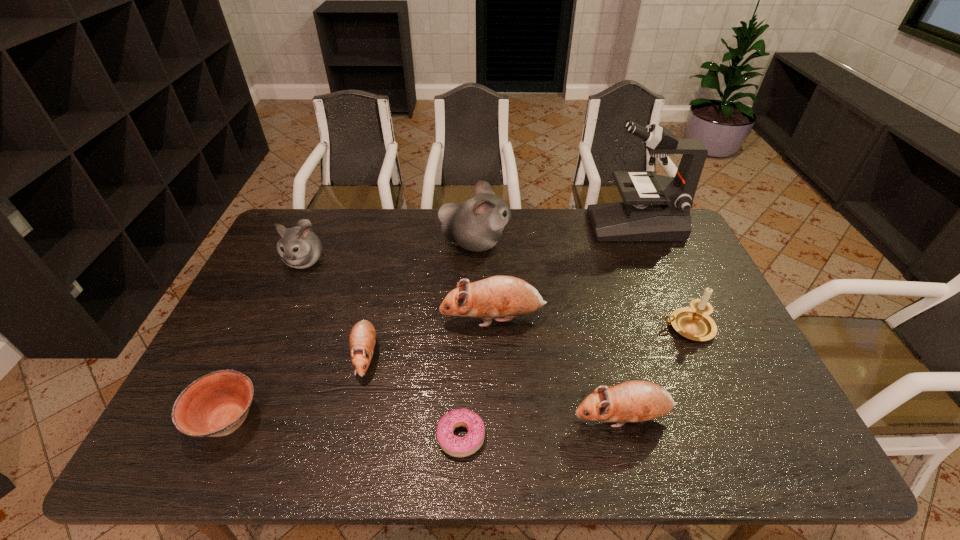
Find the location of `vacant space located on the left of the pink doughnut`. vacant space located on the left of the pink doughnut is located at coordinates (384, 437).

The width and height of the screenshot is (960, 540). In order to click on microscope positioned at the far edge in this screenshot , I will do `click(658, 209)`.

What are the coordinates of `hamster present at the near edge` in the screenshot? It's located at (633, 401).

You are a GUI agent. You are given a task and a screenshot of the screen. Output one action in this format:
    pyautogui.click(x=<x>, y=<y>)
    Task: Click on the bowl at the near edge
    
    Given the screenshot: What is the action you would take?
    (x=215, y=405)

The height and width of the screenshot is (540, 960). In order to click on doughnut that is at the near edge in this screenshot , I will do `click(455, 446)`.

Locate an element on the screen. The image size is (960, 540). hamster located at the left edge is located at coordinates (299, 247).

The width and height of the screenshot is (960, 540). Identify the location of bowl present at the left edge. (215, 405).

You are a GUI agent. You are given a task and a screenshot of the screen. Output one action in this format:
    pyautogui.click(x=<x>, y=<y>)
    Task: Click on the microscope present at the right edge
    The height and width of the screenshot is (540, 960).
    Given the screenshot: What is the action you would take?
    pyautogui.click(x=658, y=209)

The width and height of the screenshot is (960, 540). Identify the location of candle holder that is at the right edge. (694, 323).

This screenshot has width=960, height=540. Identify the location of object that is positioned at the far left corner. (299, 247).